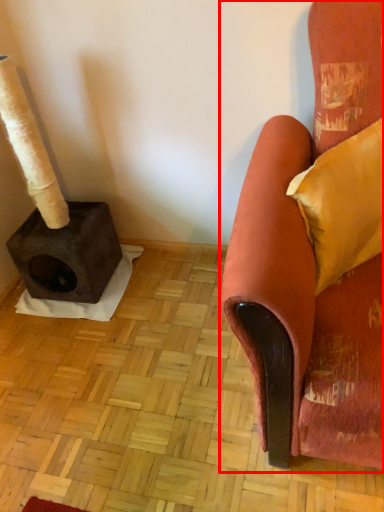
Question: Considering the relative positions of chair (annotated by the red box) and pillow in the image provided, where is chair (annotated by the red box) located with respect to the staircase?

Choices:
 (A) left
 (B) right

Answer: (A)